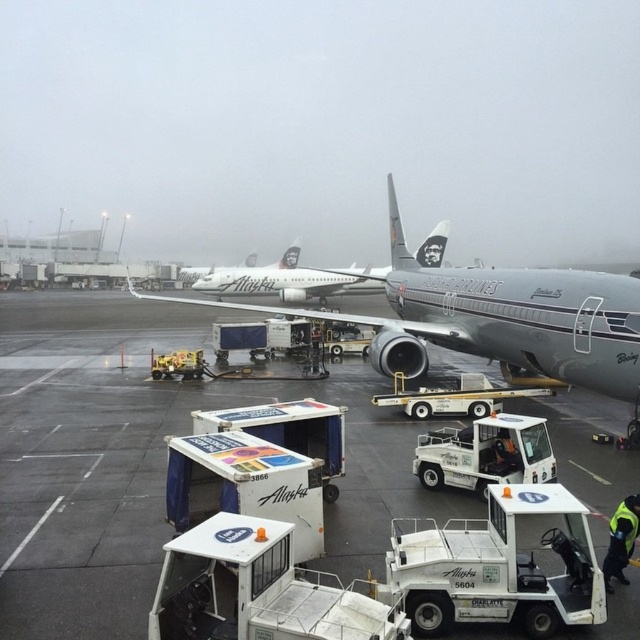
Question: Does smooth gray tarmac at center lie in front of white glossy airplane at center?

Choices:
 (A) yes
 (B) no

Answer: (A)

Question: Which object is the farthest from the smooth gray tarmac at center?

Choices:
 (A) silver metallic airplane at center
 (B) white glossy airplane at center

Answer: (B)

Question: Does smooth gray tarmac at center appear on the right side of white glossy airplane at center?

Choices:
 (A) no
 (B) yes

Answer: (B)

Question: Which object appears farthest from the camera in this image?

Choices:
 (A) smooth gray tarmac at center
 (B) silver metallic airplane at center

Answer: (B)

Question: Which of the following is the closest to the observer?

Choices:
 (A) (289, 314)
 (B) (588, 490)
 (C) (192, 269)

Answer: (B)

Question: Does smooth gray tarmac at center have a greater width compared to silver metallic airplane at center?

Choices:
 (A) no
 (B) yes

Answer: (B)